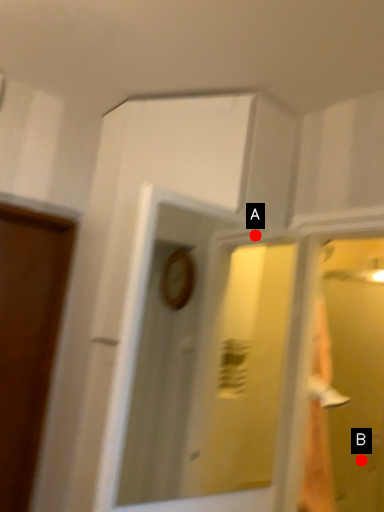
Question: Two points are circled on the image, labeled by A and B beside each circle. Which point is further to the camera?

Choices:
 (A) A is further
 (B) B is further

Answer: (B)